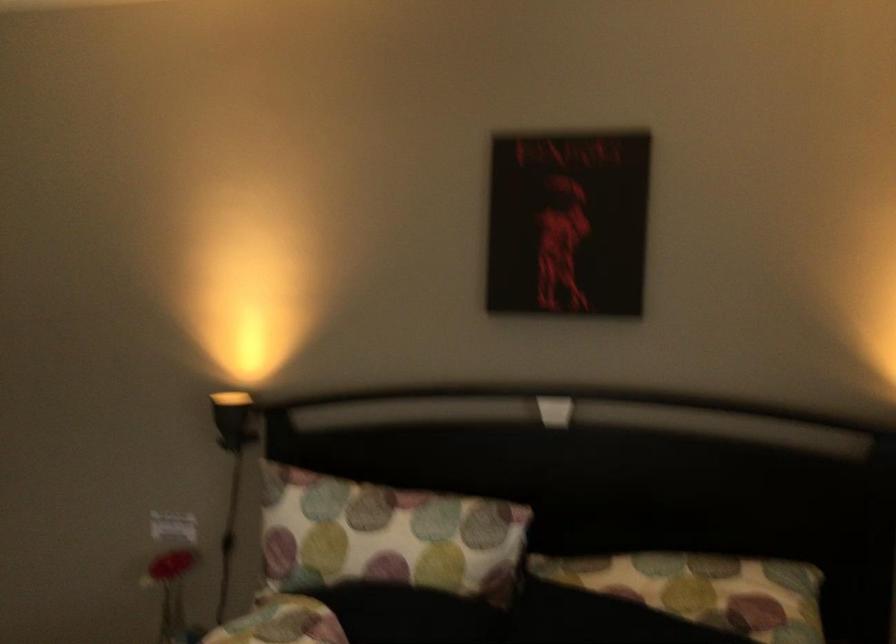
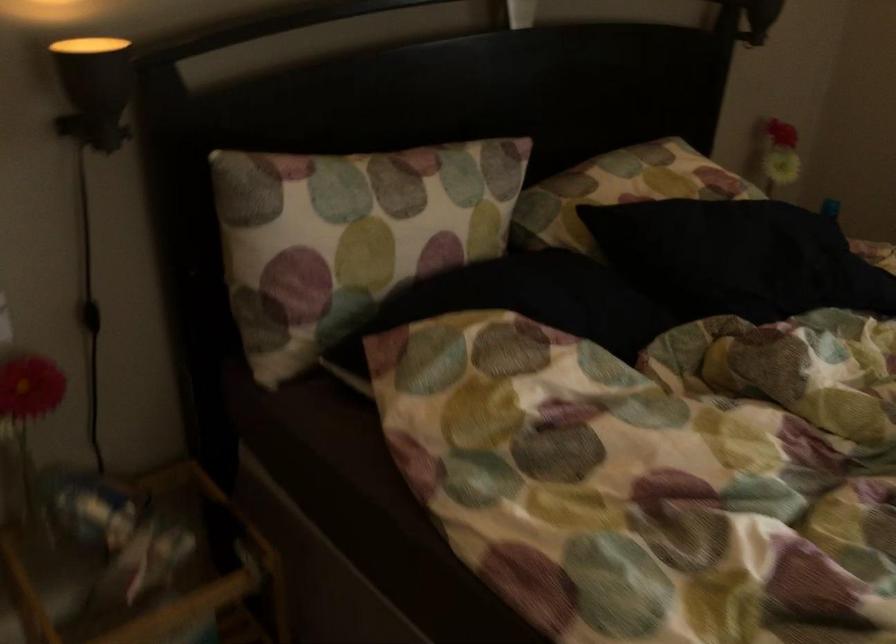
Locate, in the second image, the point that corresponds to point 247,393 in the first image.

(90, 48)